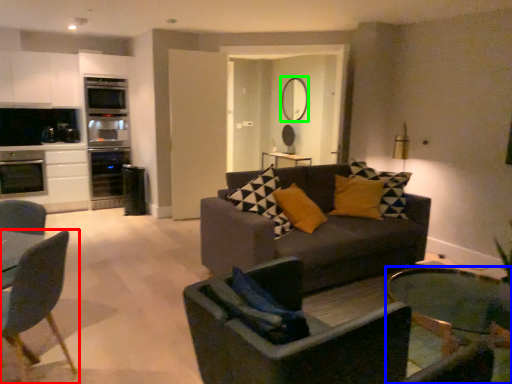
Question: Which object is the farthest from chair (highlighted by a red box)? Choose among these: coffee table (highlighted by a blue box) or mirror (highlighted by a green box).

Choices:
 (A) coffee table
 (B) mirror

Answer: (B)